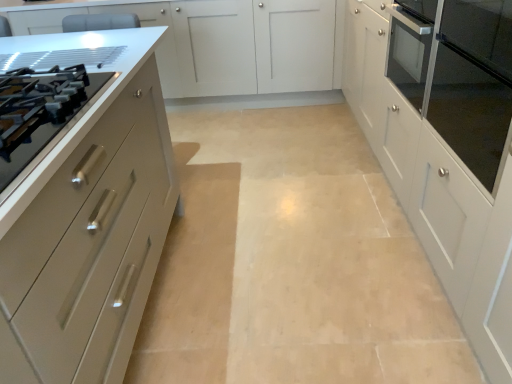
Question: Is matte beige cabinet at left, acting as the first cabinetry starting from the left, positioned behind satin silver drawer at left?

Choices:
 (A) yes
 (B) no

Answer: (B)

Question: Is matte beige cabinet at left, acting as the third cabinetry starting from the right, thinner than satin silver drawer at left?

Choices:
 (A) yes
 (B) no

Answer: (B)

Question: Can you confirm if matte beige cabinet at left, acting as the third cabinetry starting from the right, is bigger than satin silver drawer at left?

Choices:
 (A) no
 (B) yes

Answer: (B)

Question: Is the surface of matte beige cabinet at left, acting as the first cabinetry starting from the left, in direct contact with satin silver drawer at left?

Choices:
 (A) no
 (B) yes

Answer: (A)

Question: Considering the relative sizes of matte beige cabinet at left, acting as the third cabinetry starting from the right, and satin silver drawer at left in the image provided, is matte beige cabinet at left, acting as the third cabinetry starting from the right, wider than satin silver drawer at left?

Choices:
 (A) yes
 (B) no

Answer: (A)

Question: In terms of width, does matte glass oven door at right look wider or thinner when compared to matte white cabinet at center, the second cabinetry positioned from the left?

Choices:
 (A) thin
 (B) wide

Answer: (A)

Question: Is point [x=492, y=180] positioned closer to the camera than point [x=289, y=19]?

Choices:
 (A) farther
 (B) closer

Answer: (B)

Question: Based on their sizes in the image, would you say matte glass oven door at right is bigger or smaller than matte white cabinet at center, the second cabinetry positioned from the left?

Choices:
 (A) small
 (B) big

Answer: (A)

Question: From a real-world perspective, is matte glass oven door at right positioned above or below matte white cabinet at center, which is the second cabinetry from right to left?

Choices:
 (A) above
 (B) below

Answer: (A)

Question: Is satin silver drawer at left inside or outside of matte glass oven door at right?

Choices:
 (A) outside
 (B) inside

Answer: (A)

Question: In terms of height, does satin silver drawer at left look taller or shorter compared to matte glass oven door at right?

Choices:
 (A) tall
 (B) short

Answer: (B)

Question: From a real-world perspective, is satin silver drawer at left positioned above or below matte glass oven door at right?

Choices:
 (A) above
 (B) below

Answer: (A)

Question: Is satin silver drawer at left in front of or behind matte glass oven door at right in the image?

Choices:
 (A) front
 (B) behind

Answer: (A)

Question: Would you say matte beige cabinet at left, acting as the third cabinetry starting from the right, is to the left or to the right of white glossy cabinet at right, placed as the third cabinetry when sorted from left to right, in the picture?

Choices:
 (A) left
 (B) right

Answer: (A)

Question: Is point (95, 349) closer or farther from the camera than point (408, 21)?

Choices:
 (A) farther
 (B) closer

Answer: (B)